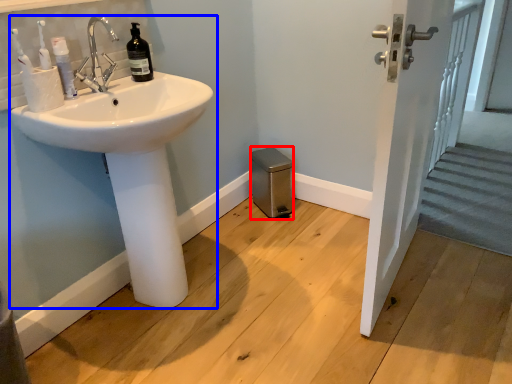
Question: Among these objects, which one is nearest to the camera, bidet (highlighted by a red box) or sink (highlighted by a blue box)?

Choices:
 (A) bidet
 (B) sink

Answer: (B)